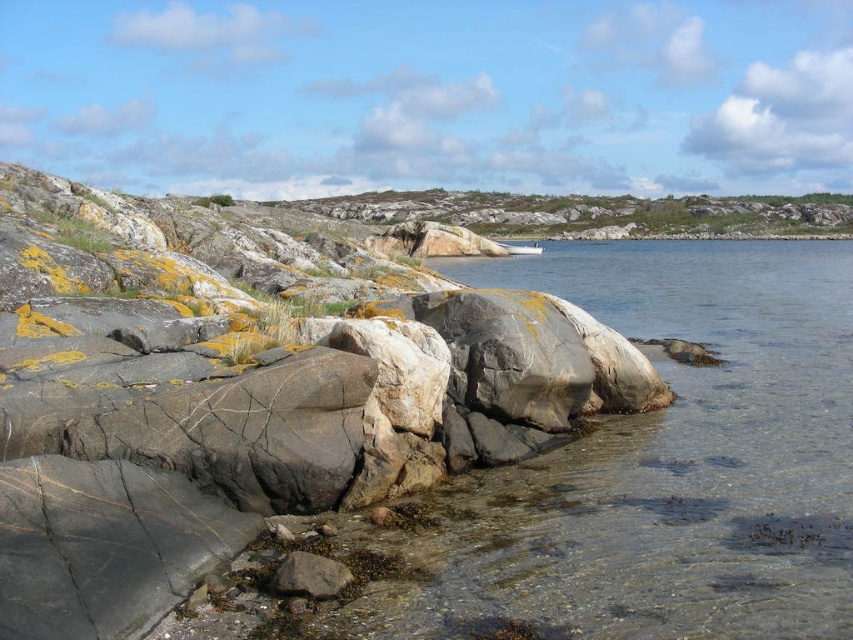
Question: Which object is farther from the camera taking this photo?

Choices:
 (A) gray rough rock at lower center
 (B) gray/rough rock at center

Answer: (A)

Question: Is gray/rough rock at center smaller than gray rough rock at lower center?

Choices:
 (A) no
 (B) yes

Answer: (A)

Question: Estimate the real-world distances between objects in this image. Which object is farther from the gray rough rock at lower center?

Choices:
 (A) gray/rough rock at center
 (B) clear water at lower right

Answer: (A)

Question: Can you confirm if gray/rough rock at center is positioned above gray rough rock at lower center?

Choices:
 (A) yes
 (B) no

Answer: (A)

Question: Is clear water at lower right above gray rough rock at lower center?

Choices:
 (A) yes
 (B) no

Answer: (A)

Question: Among these objects, which one is farthest from the camera?

Choices:
 (A) gray rough rock at lower center
 (B) clear water at lower right

Answer: (A)